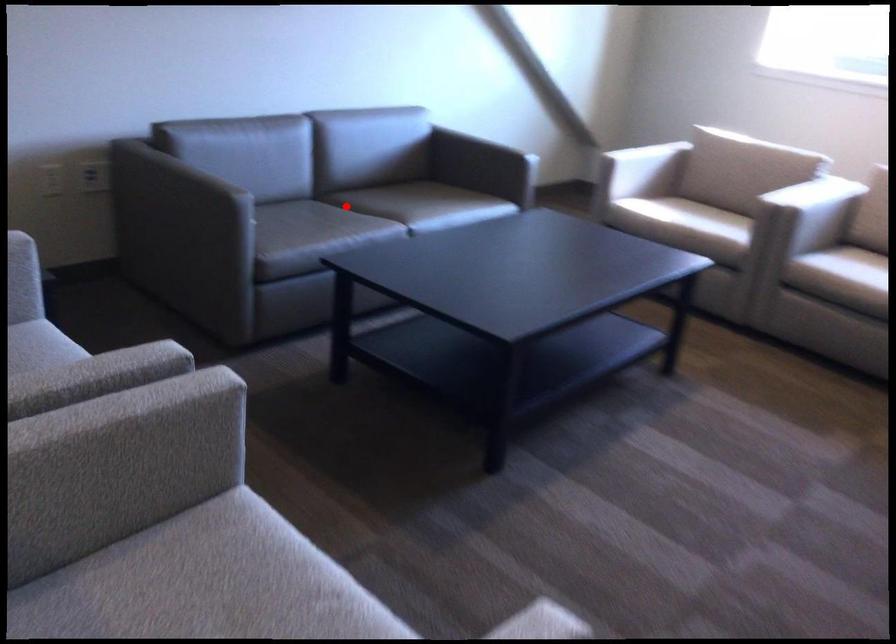
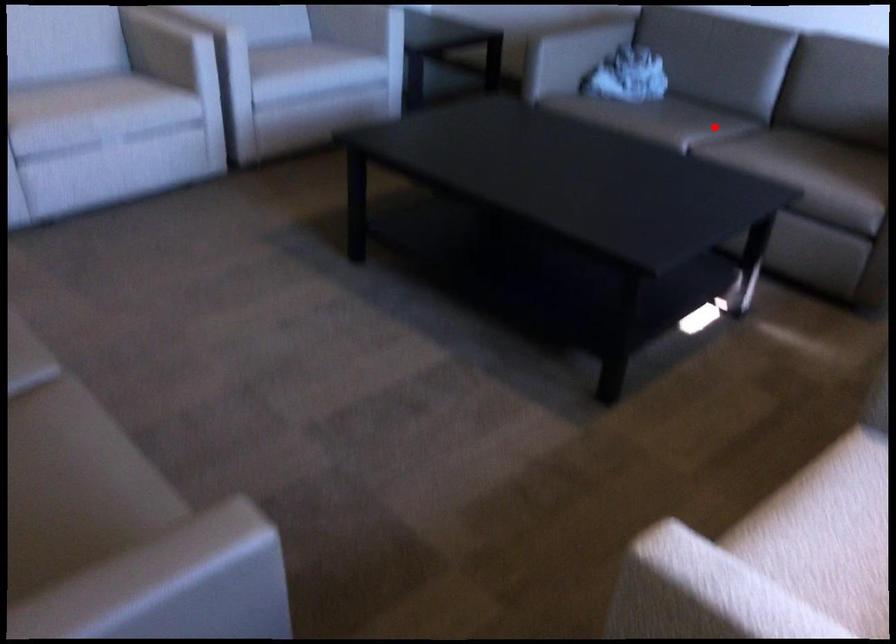
I am providing you with two images of the same scene from different viewpoints. A red point is marked on the first image and another point is marked on the second image. Do the highlighted points in image1 and image2 indicate the same real-world spot?

Yes